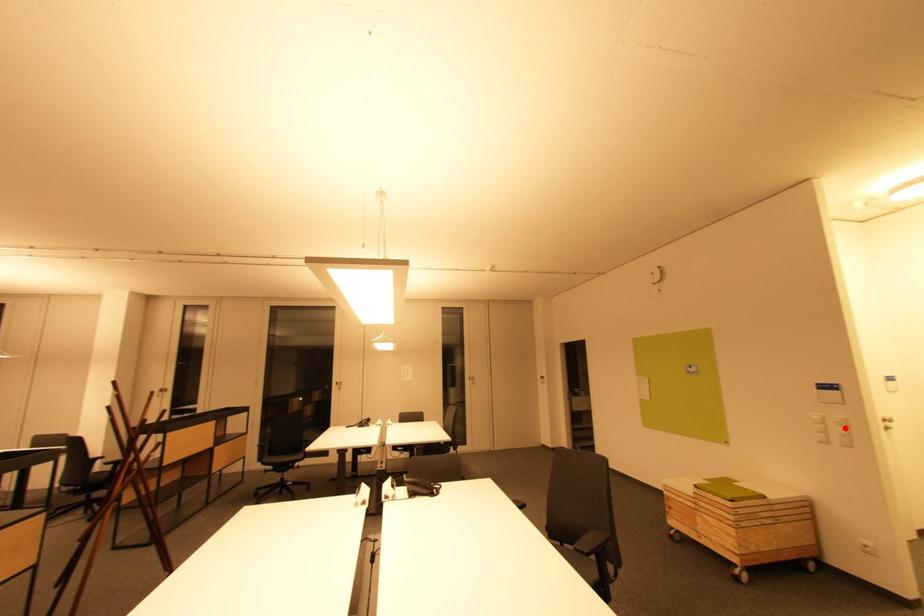
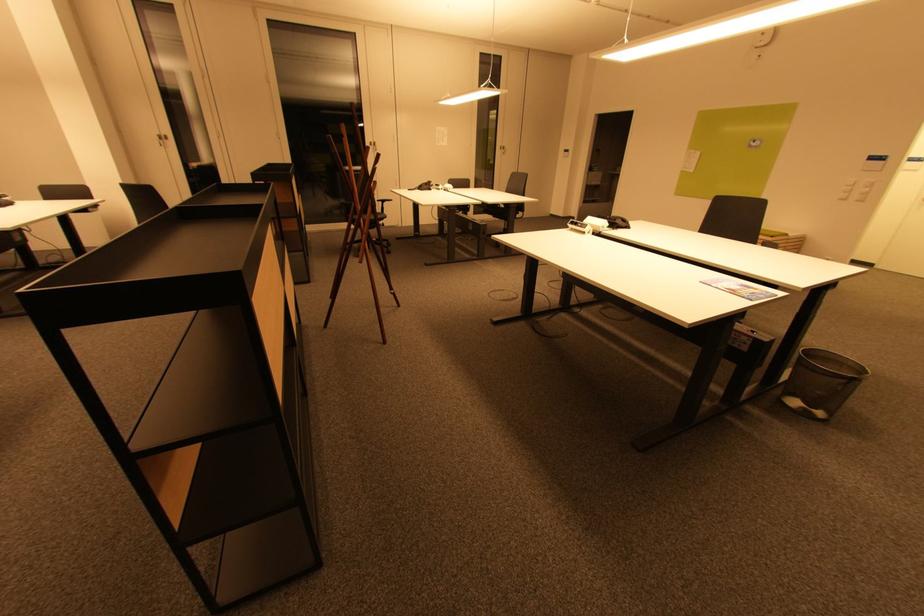
Question: I am providing you with two images of the same scene from different viewpoints. A red point is marked on the first image. Is the red point's position out of view in image 2?

Choices:
 (A) Yes
 (B) No

Answer: (B)